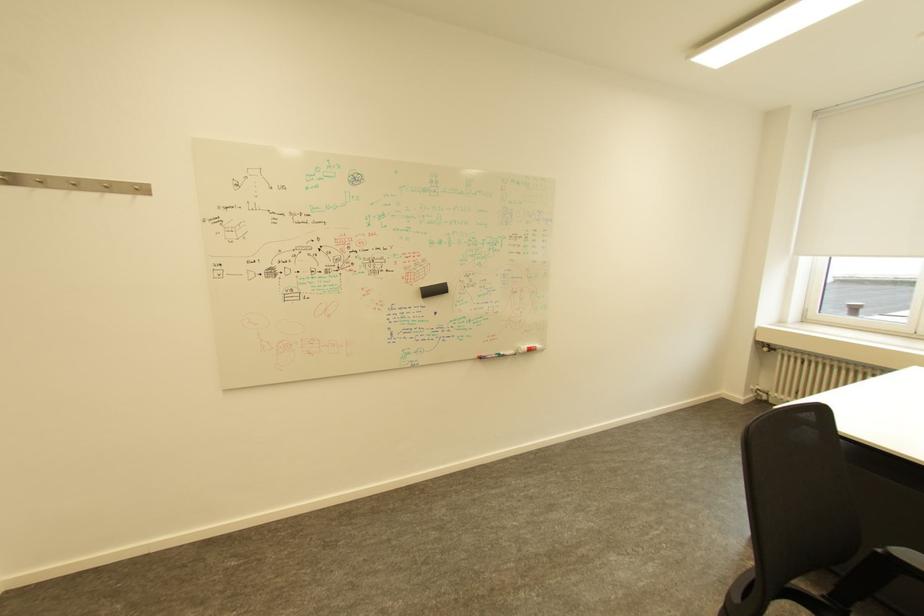
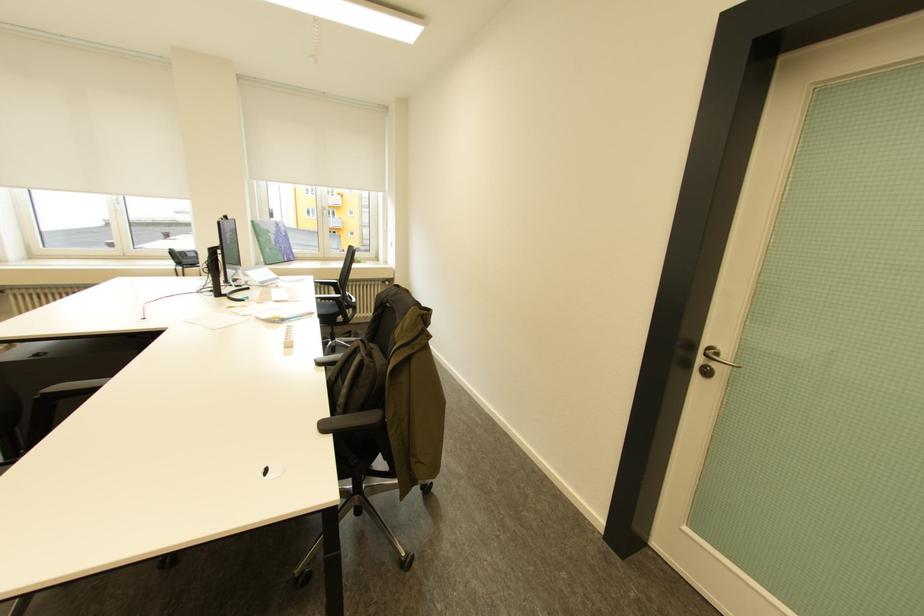
The first image is from the beginning of the video and the second image is from the end. How did the camera likely rotate when shooting the video?

The rotation direction of the camera is right-down.